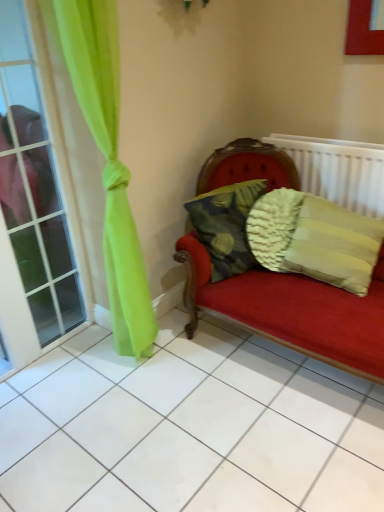
Question: Is point (x=365, y=160) closer or farther from the camera than point (x=3, y=222)?

Choices:
 (A) farther
 (B) closer

Answer: (A)

Question: From the image's perspective, is white textured radiator at upper right above or below clear glass window at left?

Choices:
 (A) below
 (B) above

Answer: (B)

Question: Which of these objects is positioned closest to the clear glass window at left?

Choices:
 (A) white textured radiator at upper right
 (B) textured beige pillow at right, arranged as the first pillow when viewed from the right
 (C) camouflage fabric pillow at center, the 1th pillow positioned from the left

Answer: (C)

Question: Which object is positioned farthest from the white textured radiator at upper right?

Choices:
 (A) textured beige pillow at right, arranged as the first pillow when viewed from the right
 (B) camouflage fabric pillow at center, the 1th pillow positioned from the left
 (C) clear glass window at left

Answer: (C)